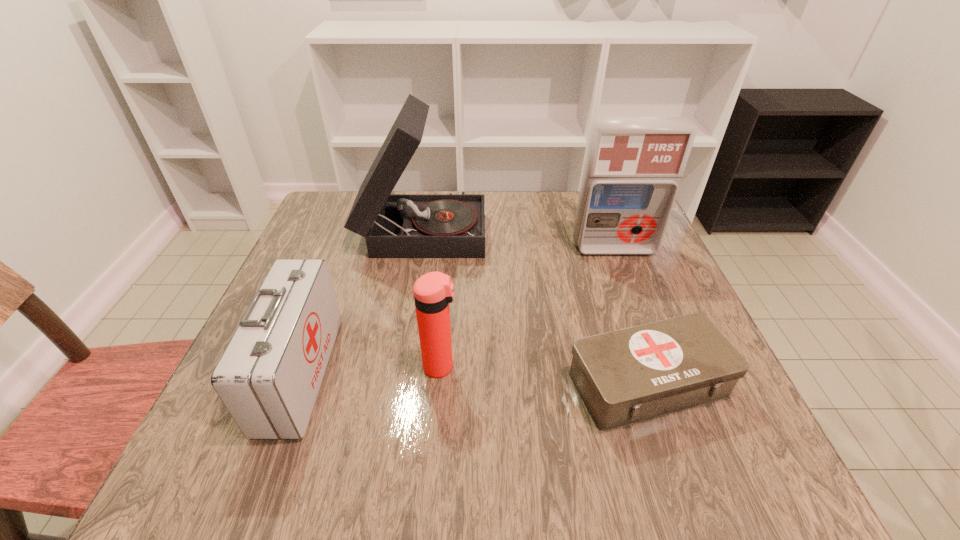
Locate an element on the screen. free space at the right edge is located at coordinates [655, 274].

In the image, there is a desktop. Identify the location of free space at the far left corner. This screenshot has height=540, width=960. (347, 198).

Identify the location of empty space between the shortest object and the tallest first-aid kit. pos(631,316).

This screenshot has width=960, height=540. I want to click on vacant area that lies between the phonograph_record and the shortest first-aid kit, so click(x=536, y=306).

Image resolution: width=960 pixels, height=540 pixels. What are the coordinates of `free spot between the phonograph_record and the second shortest first-aid kit` in the screenshot? It's located at (362, 301).

This screenshot has height=540, width=960. I want to click on unoccupied area between the leftmost first-aid kit and the phonograph_record, so click(362, 301).

Locate an element on the screen. Image resolution: width=960 pixels, height=540 pixels. free space between the phonograph_record and the shortest object is located at coordinates pos(536,306).

This screenshot has width=960, height=540. What are the coordinates of `free space between the shortest first-aid kit and the thermos bottle` in the screenshot? It's located at (544, 375).

Find the location of `unoccupied position between the shortest object and the phonograph_record`. unoccupied position between the shortest object and the phonograph_record is located at coordinates (536, 306).

What are the coordinates of `vacant area that lies between the fourth tallest object and the tallest first-aid kit` in the screenshot? It's located at [458, 310].